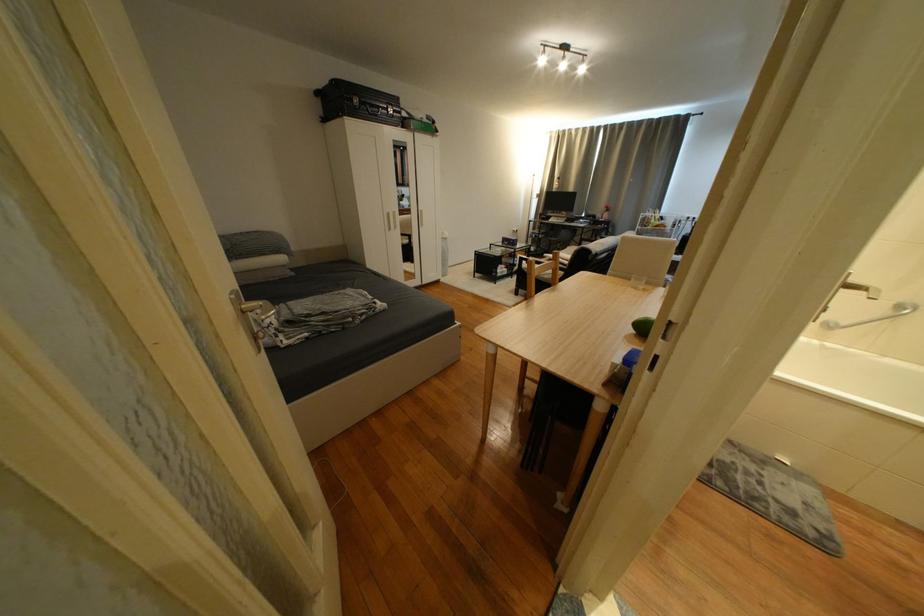
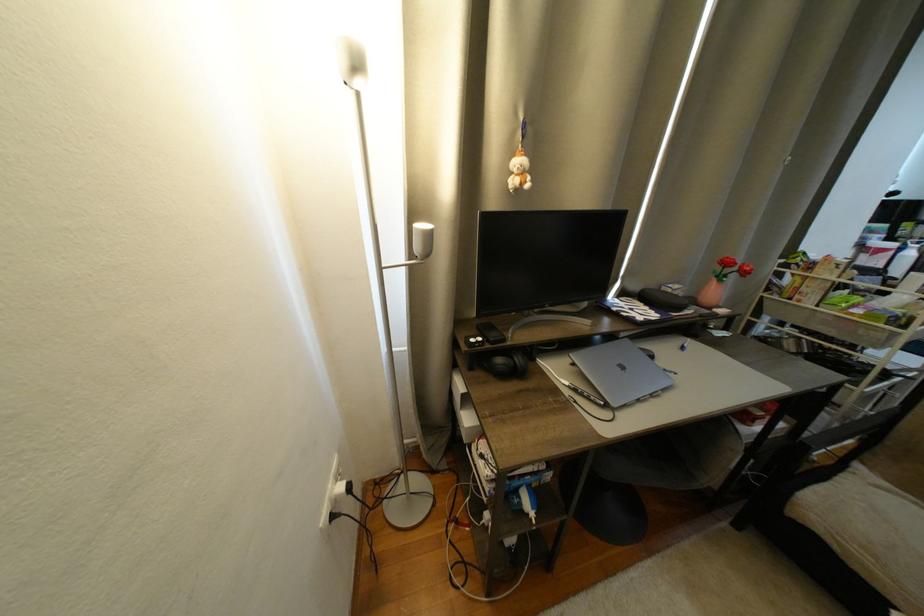
Where in the second image is the point corresponding to point (525, 232) from the first image?

(358, 490)